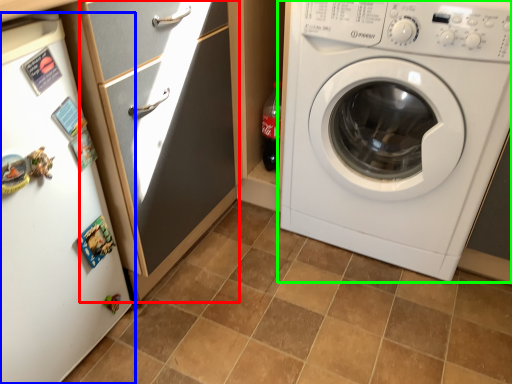
Question: Based on their relative distances, which object is nearer to screen door (highlighted by a red box)? Choose from fridge (highlighted by a blue box) and washing machine (highlighted by a green box).

Choices:
 (A) fridge
 (B) washing machine

Answer: (A)